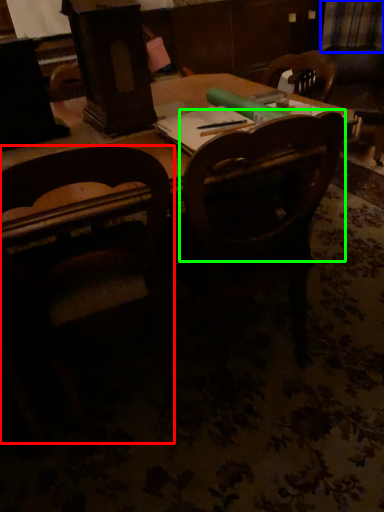
Question: Considering the real-world distances, which object is closest to chair (highlighted by a red box)? plaid (highlighted by a blue box) or chair (highlighted by a green box).

Choices:
 (A) plaid
 (B) chair

Answer: (B)